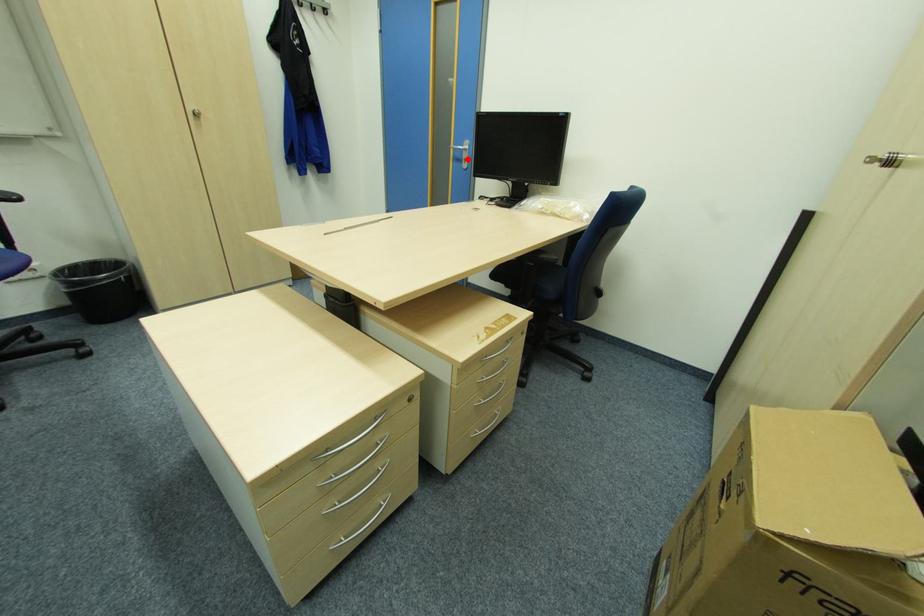
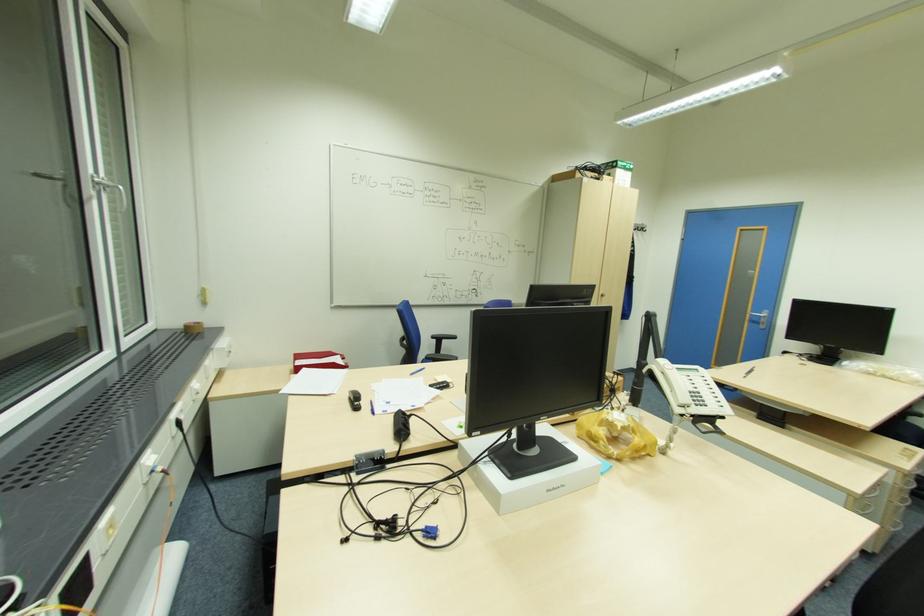
In the second image, find the point that corresponds to the highlighted location in the first image.

(766, 323)